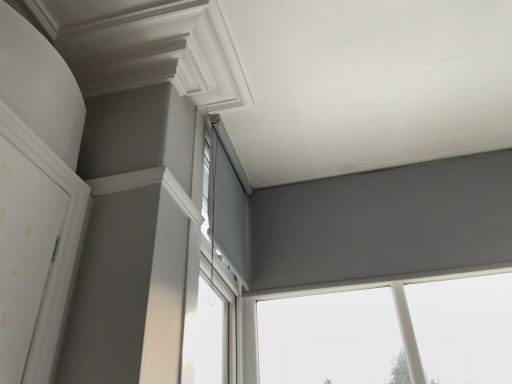
Measure the distance between point (229, 193) and camera.

The distance of point (229, 193) from camera is 7.12 feet.

At what (x,y) coordinates should I click in order to perform the action: click on matte gray window at upper center, placed as the first window when sorted from right to left. Please return your answer as a coordinate pair (x, y). Looking at the image, I should click on (384, 332).

From a real-world perspective, is white plastic window at upper center, the third window when ordered from right to left, on top of matte gray window at upper center, the third window positioned from the left?

No, from a real-world perspective, white plastic window at upper center, the third window when ordered from right to left, is not over matte gray window at upper center, the third window positioned from the left

Is white plastic window at upper center, acting as the first window starting from the left, bigger than matte gray window at upper center, the third window positioned from the left?

No, white plastic window at upper center, acting as the first window starting from the left, is not bigger than matte gray window at upper center, the third window positioned from the left.

This screenshot has height=384, width=512. Identify the location of window below the matte gray window at upper center, the third window positioned from the left (from a real-world perspective). (209, 266).

Can you confirm if white plastic window at upper center, acting as the first window starting from the left, is shorter than matte gray window at upper center, the third window positioned from the left?

No, white plastic window at upper center, acting as the first window starting from the left, is not shorter than matte gray window at upper center, the third window positioned from the left.

Is matte gray window at upper center, the third window positioned from the left, thinner than matte gray roller blind at center, the second window from the left?

No.

Considering the positions of objects matte gray window at upper center, the third window positioned from the left, and matte gray roller blind at center, the second window from the left, in the image provided, who is in front, matte gray window at upper center, the third window positioned from the left, or matte gray roller blind at center, the second window from the left,?

matte gray roller blind at center, the second window from the left.

Is matte gray window at upper center, placed as the first window when sorted from right to left, oriented away from matte gray roller blind at center, the second window from the left?

No, matte gray roller blind at center, the second window from the left, is not at the back of matte gray window at upper center, placed as the first window when sorted from right to left.

Is matte gray window at upper center, the third window positioned from the left, positioned beyond the bounds of matte gray roller blind at center, acting as the 2th window starting from the right?

Yes, matte gray window at upper center, the third window positioned from the left, is located beyond the bounds of matte gray roller blind at center, acting as the 2th window starting from the right.

Is the position of matte gray window at upper center, placed as the first window when sorted from right to left, less distant than that of white plastic window at upper center, acting as the first window starting from the left?

No, matte gray window at upper center, placed as the first window when sorted from right to left, is further to the viewer.

Is matte gray window at upper center, placed as the first window when sorted from right to left, located outside white plastic window at upper center, acting as the first window starting from the left?

Indeed, matte gray window at upper center, placed as the first window when sorted from right to left, is completely outside white plastic window at upper center, acting as the first window starting from the left.

Is matte gray window at upper center, placed as the first window when sorted from right to left, taller or shorter than white plastic window at upper center, the third window when ordered from right to left?

matte gray window at upper center, placed as the first window when sorted from right to left, is shorter than white plastic window at upper center, the third window when ordered from right to left.

Is point (498, 335) closer to viewer compared to point (184, 355)?

No.

Is matte gray roller blind at center, acting as the 2th window starting from the right, inside the boundaries of white plastic window at upper center, acting as the first window starting from the left, or outside?

matte gray roller blind at center, acting as the 2th window starting from the right, cannot be found inside white plastic window at upper center, acting as the first window starting from the left.

Is matte gray roller blind at center, acting as the 2th window starting from the right, aimed at white plastic window at upper center, the third window when ordered from right to left?

No, matte gray roller blind at center, acting as the 2th window starting from the right, is not facing towards white plastic window at upper center, the third window when ordered from right to left.

Can you tell me how much matte gray roller blind at center, the second window from the left, and white plastic window at upper center, acting as the first window starting from the left, differ in facing direction?

The angle between the facing direction of matte gray roller blind at center, the second window from the left, and the facing direction of white plastic window at upper center, acting as the first window starting from the left, is 1.76 degrees.

This screenshot has width=512, height=384. I want to click on window on the left of matte gray roller blind at center, acting as the 2th window starting from the right, so click(x=209, y=266).

Is white plastic window at upper center, acting as the first window starting from the left, oriented away from matte gray roller blind at center, the second window from the left?

Yes, white plastic window at upper center, acting as the first window starting from the left, is facing away from matte gray roller blind at center, the second window from the left.

At what (x,y) coordinates should I click in order to perform the action: click on window that appears above the white plastic window at upper center, acting as the first window starting from the left (from the image's perspective). Please return your answer as a coordinate pair (x, y). Looking at the image, I should click on (225, 205).

Considering the relative positions of white plastic window at upper center, the third window when ordered from right to left, and matte gray roller blind at center, the second window from the left, in the image provided, is white plastic window at upper center, the third window when ordered from right to left, to the left or to the right of matte gray roller blind at center, the second window from the left,?

Based on their positions, white plastic window at upper center, the third window when ordered from right to left, is located to the left of matte gray roller blind at center, the second window from the left.

Between white plastic window at upper center, the third window when ordered from right to left, and matte gray roller blind at center, acting as the 2th window starting from the right, which one has smaller size?

With smaller size is matte gray roller blind at center, acting as the 2th window starting from the right.

Which is farther from the camera, (219, 156) or (431, 282)?

A: The point (431, 282) is farther.

Choose the correct answer: Is matte gray roller blind at center, acting as the 2th window starting from the right, inside matte gray window at upper center, placed as the first window when sorted from right to left, or outside it?

matte gray roller blind at center, acting as the 2th window starting from the right, cannot be found inside matte gray window at upper center, placed as the first window when sorted from right to left.

Who is bigger, matte gray roller blind at center, the second window from the left, or matte gray window at upper center, the third window positioned from the left?

Bigger between the two is matte gray window at upper center, the third window positioned from the left.

Who is more distant, matte gray roller blind at center, acting as the 2th window starting from the right, or matte gray window at upper center, the third window positioned from the left?

matte gray window at upper center, the third window positioned from the left, is further away from the camera.

Locate an element on the screen. This screenshot has width=512, height=384. the 1st window located above the white plastic window at upper center, the third window when ordered from right to left (from a real-world perspective) is located at coordinates (384, 332).

I want to click on the 1st window below the matte gray roller blind at center, the second window from the left (from a real-world perspective), so click(384, 332).

Based on their spatial positions, is matte gray window at upper center, placed as the first window when sorted from right to left, or white plastic window at upper center, the third window when ordered from right to left, further from matte gray roller blind at center, the second window from the left?

The object further to matte gray roller blind at center, the second window from the left, is matte gray window at upper center, placed as the first window when sorted from right to left.

Considering their positions, is matte gray roller blind at center, the second window from the left, positioned closer to matte gray window at upper center, the third window positioned from the left, than white plastic window at upper center, acting as the first window starting from the left?

white plastic window at upper center, acting as the first window starting from the left, lies closer to matte gray window at upper center, the third window positioned from the left, than the other object.

Based on their spatial positions, is matte gray window at upper center, placed as the first window when sorted from right to left, or matte gray roller blind at center, acting as the 2th window starting from the right, closer to white plastic window at upper center, acting as the first window starting from the left?

Among the two, matte gray roller blind at center, acting as the 2th window starting from the right, is located nearer to white plastic window at upper center, acting as the first window starting from the left.

From the image, which object appears to be farther from matte gray roller blind at center, acting as the 2th window starting from the right, white plastic window at upper center, the third window when ordered from right to left, or matte gray window at upper center, the third window positioned from the left?

Among the two, matte gray window at upper center, the third window positioned from the left, is located further to matte gray roller blind at center, acting as the 2th window starting from the right.

Estimate the real-world distances between objects in this image. Which object is closer to matte gray window at upper center, placed as the first window when sorted from right to left, white plastic window at upper center, acting as the first window starting from the left, or matte gray roller blind at center, the second window from the left?

white plastic window at upper center, acting as the first window starting from the left, is closer to matte gray window at upper center, placed as the first window when sorted from right to left.

From the picture: Based on their spatial positions, is matte gray roller blind at center, the second window from the left, or matte gray window at upper center, placed as the first window when sorted from right to left, closer to white plastic window at upper center, acting as the first window starting from the left?

matte gray roller blind at center, the second window from the left.

Find the location of a particular element. The width and height of the screenshot is (512, 384). window between white plastic window at upper center, the third window when ordered from right to left, and matte gray window at upper center, the third window positioned from the left is located at coordinates (225, 205).